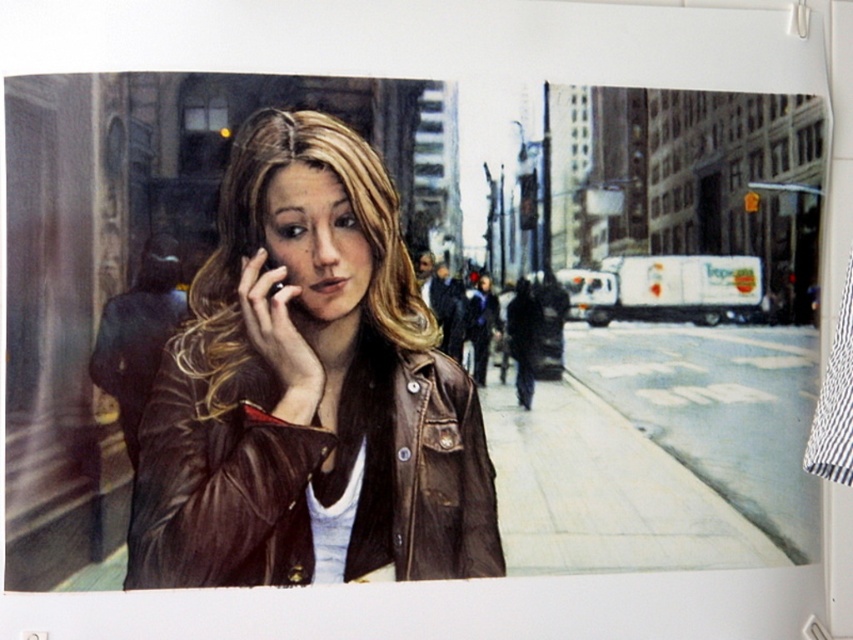
You are a fashion designer observing the woman in the scene. You need to determine if the matte black phone at center can fit into one of the pockets of the brown leather jacket at center. Based on their sizes, can it fit?

The brown leather jacket at center is wider than the matte black phone at center, so the phone can likely fit into one of the pockets.